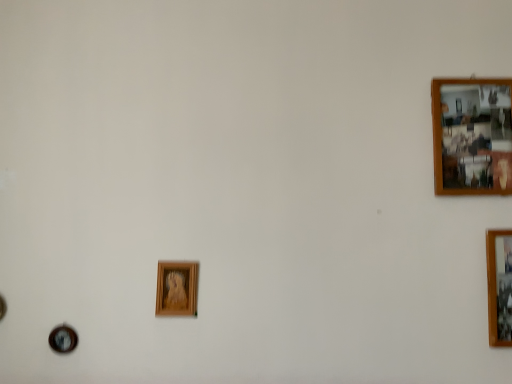
Question: Is the depth of wooden picture frame at center, the third picture frame positioned from the top, greater than that of wooden photo frame at upper right, acting as the 2th picture frame starting from the right?

Choices:
 (A) no
 (B) yes

Answer: (A)

Question: From a real-world perspective, is wooden picture frame at center, the third picture frame positioned from the top, positioned under wooden photo frame at upper right, acting as the 2th picture frame starting from the right, based on gravity?

Choices:
 (A) yes
 (B) no

Answer: (A)

Question: Can you confirm if wooden picture frame at center, the third picture frame positioned from the top, is bigger than wooden photo frame at upper right, marked as the 3th picture frame in a bottom-to-top arrangement?

Choices:
 (A) no
 (B) yes

Answer: (A)

Question: Does wooden picture frame at center, arranged as the 1th picture frame when ordered from the bottom, have a greater width compared to wooden photo frame at upper right, the 2th picture frame from the left?

Choices:
 (A) yes
 (B) no

Answer: (B)

Question: Is wooden picture frame at center, the 1th picture frame from the left, facing away from wooden photo frame at upper right, which appears as the first picture frame when viewed from the top?

Choices:
 (A) yes
 (B) no

Answer: (B)

Question: In the image, is wooden photo frame at right, the 2th picture frame from the top, positioned in front of or behind wooden picture frame at center, arranged as the 1th picture frame when ordered from the bottom?

Choices:
 (A) behind
 (B) front

Answer: (B)

Question: From a real-world perspective, is wooden photo frame at right, the 1th picture frame when ordered from right to left, positioned above or below wooden picture frame at center, the 3th picture frame in the right-to-left sequence?

Choices:
 (A) above
 (B) below

Answer: (B)

Question: Is wooden photo frame at right, marked as the 2th picture frame in a bottom-to-top arrangement, taller or shorter than wooden picture frame at center, the 1th picture frame from the left?

Choices:
 (A) tall
 (B) short

Answer: (A)

Question: Would you say wooden photo frame at right, the 1th picture frame when ordered from right to left, is inside or outside wooden picture frame at center, the 3th picture frame in the right-to-left sequence?

Choices:
 (A) inside
 (B) outside

Answer: (B)

Question: Based on their sizes in the image, would you say wooden photo frame at right, the 1th picture frame when ordered from right to left, is bigger or smaller than wooden photo frame at upper right, the 2th picture frame from the left?

Choices:
 (A) small
 (B) big

Answer: (B)

Question: From the image's perspective, is wooden photo frame at right, the 3th picture frame when ordered from left to right, located above or below wooden photo frame at upper right, the 2th picture frame from the left?

Choices:
 (A) below
 (B) above

Answer: (A)

Question: From a real-world perspective, is wooden photo frame at right, the 2th picture frame from the top, physically located above or below wooden photo frame at upper right, marked as the 3th picture frame in a bottom-to-top arrangement?

Choices:
 (A) above
 (B) below

Answer: (B)

Question: Is point (504, 235) closer or farther from the camera than point (478, 132)?

Choices:
 (A) farther
 (B) closer

Answer: (B)

Question: Does point (444, 91) appear closer or farther from the camera than point (163, 301)?

Choices:
 (A) farther
 (B) closer

Answer: (A)

Question: Which is correct: wooden photo frame at upper right, marked as the 3th picture frame in a bottom-to-top arrangement, is inside wooden picture frame at center, the 1th picture frame from the left, or outside of it?

Choices:
 (A) inside
 (B) outside

Answer: (B)